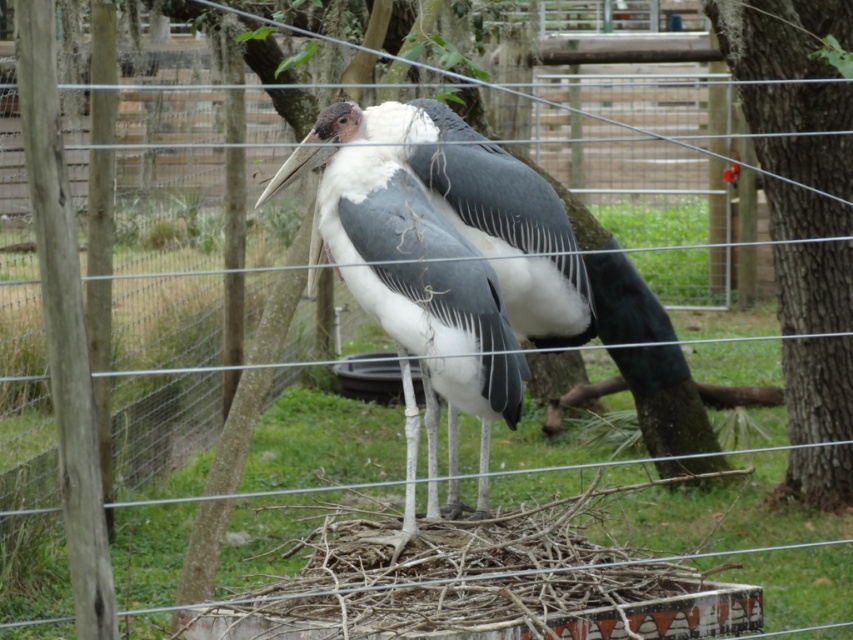
Question: Can you confirm if white feathered bird at center is positioned above smooth bark tree at right?

Choices:
 (A) no
 (B) yes

Answer: (A)

Question: Which object is closer to the camera taking this photo?

Choices:
 (A) white feathered bird at center
 (B) smooth bark tree at right

Answer: (A)

Question: From the image, what is the correct spatial relationship of white feathered bird at center in relation to smooth bark tree at right?

Choices:
 (A) left
 (B) right

Answer: (A)

Question: Among these objects, which one is nearest to the camera?

Choices:
 (A) smooth bark tree at right
 (B) white feathered bird at center

Answer: (B)

Question: Is white feathered bird at center below smooth bark tree at right?

Choices:
 (A) no
 (B) yes

Answer: (B)

Question: Among these objects, which one is nearest to the camera?

Choices:
 (A) smooth bark tree at right
 (B) white feathered bird at center

Answer: (B)